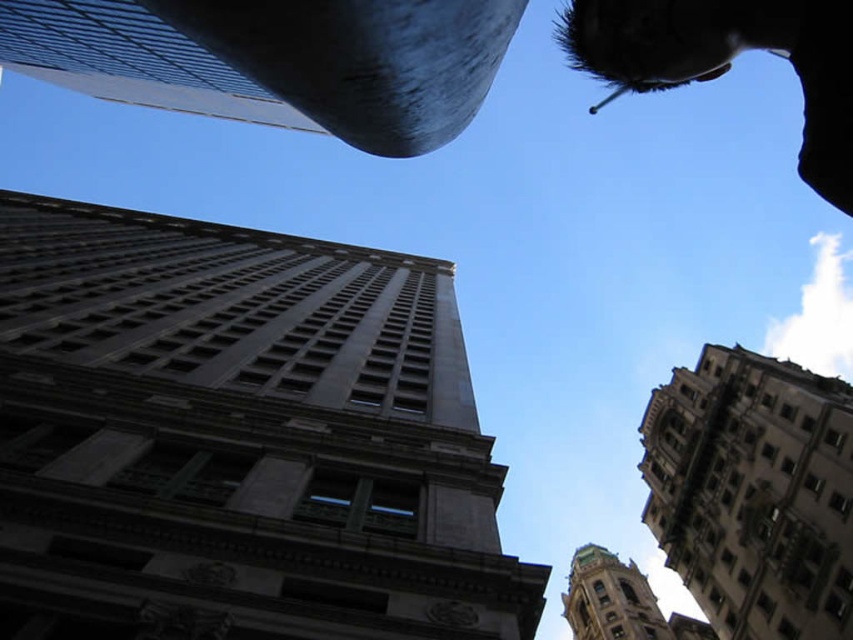
Question: Is silvery hair at upper right to the right of green copper tower at lower right from the viewer's perspective?

Choices:
 (A) no
 (B) yes

Answer: (A)

Question: Which of these objects is positioned farthest from the gray stone tower at center?

Choices:
 (A) green copper tower at lower right
 (B) brown stone tower at upper right
 (C) silvery hair at upper right

Answer: (A)

Question: Which of the following is the closest to the observer?

Choices:
 (A) (299, 586)
 (B) (821, 145)
 (C) (604, 618)

Answer: (B)

Question: Is gray stone tower at center below silvery hair at upper right?

Choices:
 (A) yes
 (B) no

Answer: (A)

Question: Is gray stone tower at center thinner than green copper tower at lower right?

Choices:
 (A) no
 (B) yes

Answer: (A)

Question: Which object is closer to the camera taking this photo?

Choices:
 (A) green copper tower at lower right
 (B) gray stone tower at center

Answer: (B)